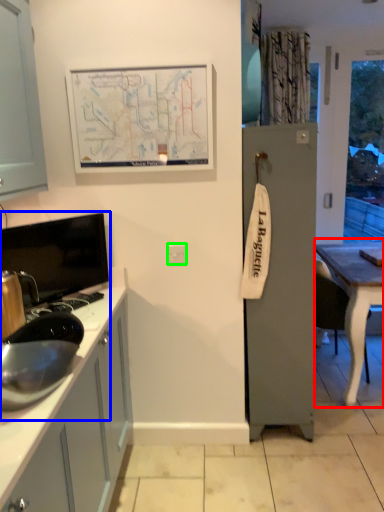
Question: Estimate the real-world distances between objects in this image. Which object is closer to table (highlighted by a red box), sink (highlighted by a blue box) or electric outlet (highlighted by a green box)?

Choices:
 (A) sink
 (B) electric outlet

Answer: (B)